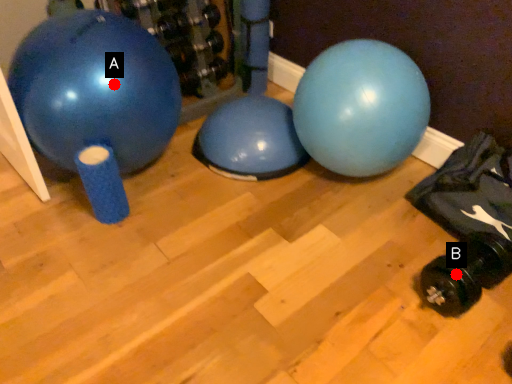
Question: Two points are circled on the image, labeled by A and B beside each circle. Which point appears farthest from the camera in this image?

Choices:
 (A) A is further
 (B) B is further

Answer: (A)